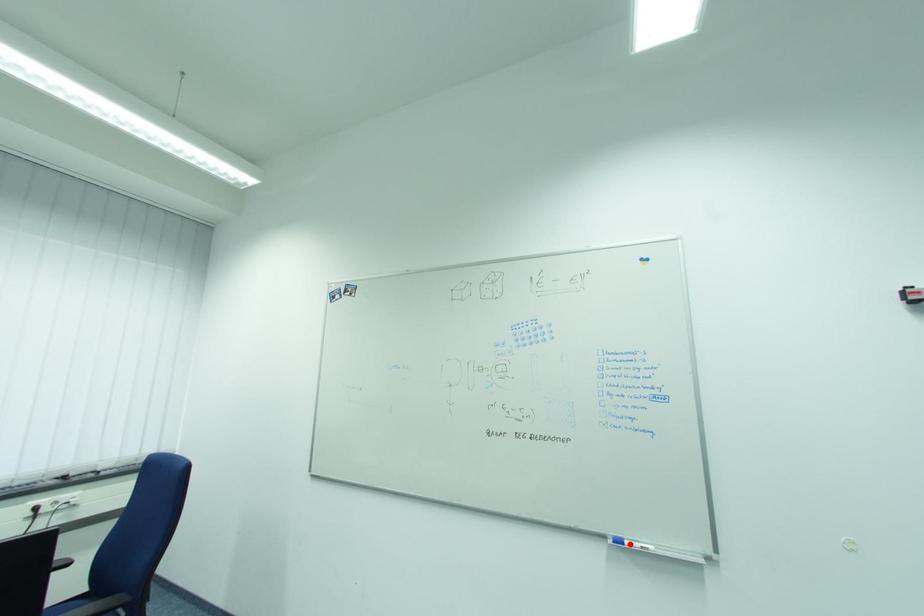
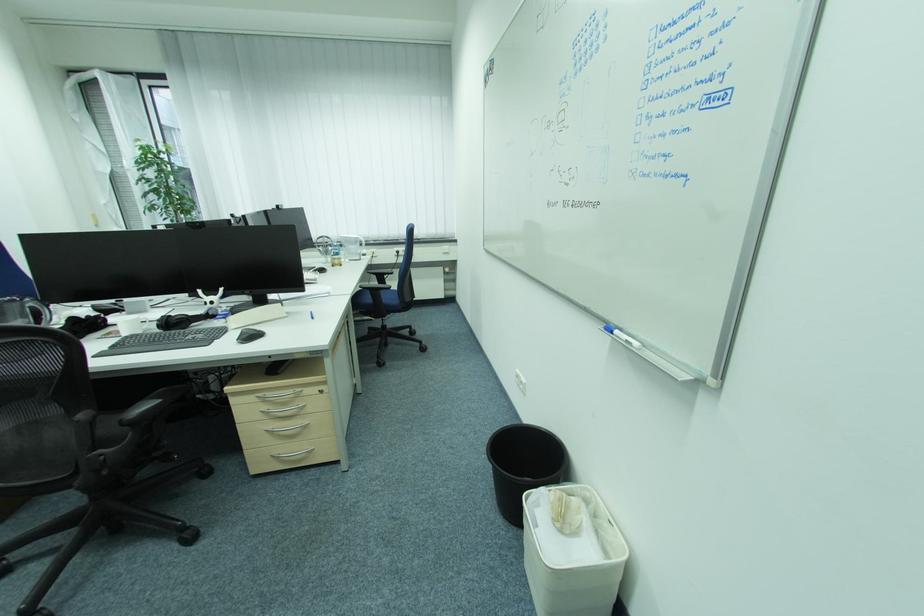
Find the pixel in the second image that matches the highlighted location in the first image.

(618, 334)